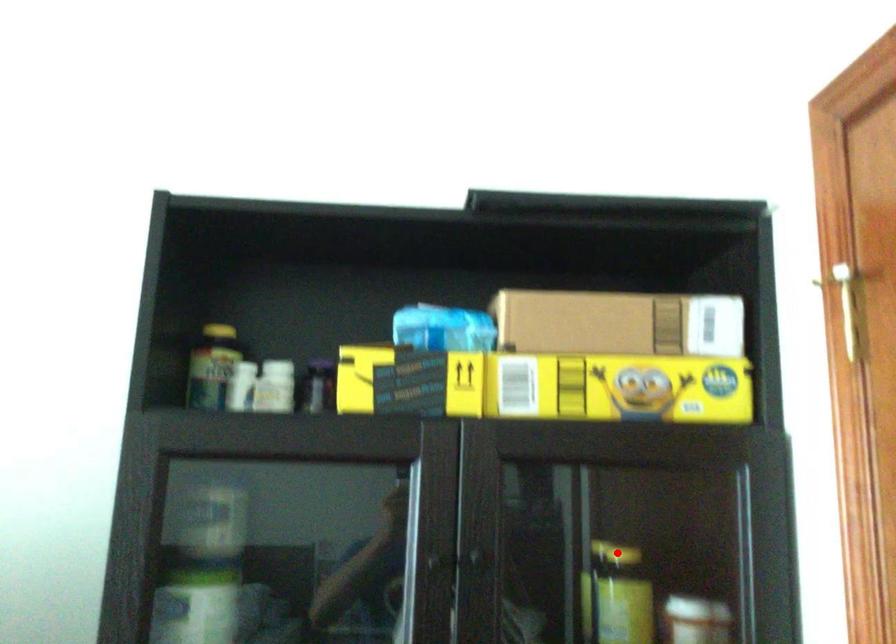
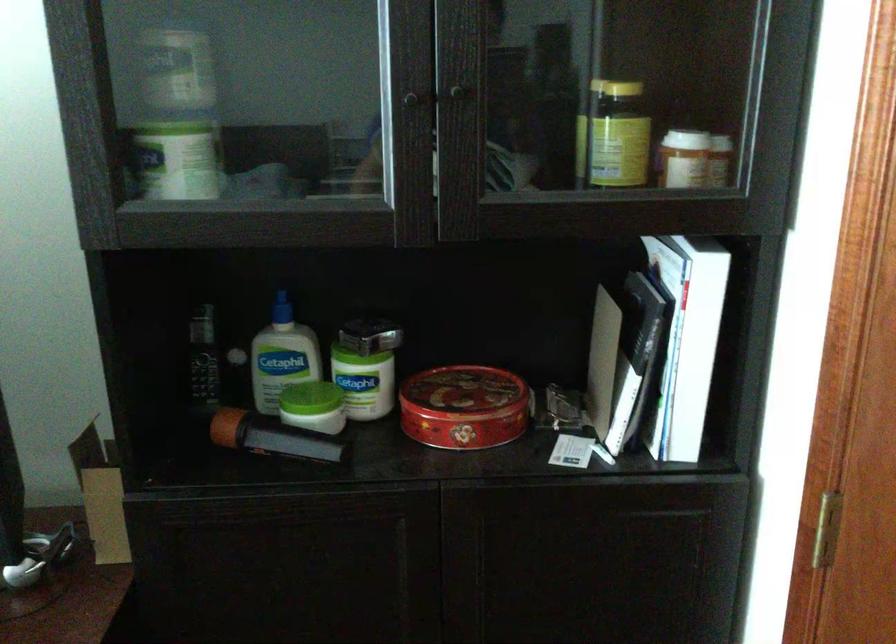
Locate, in the second image, the point that corresponds to the highlighted location in the first image.

(615, 89)